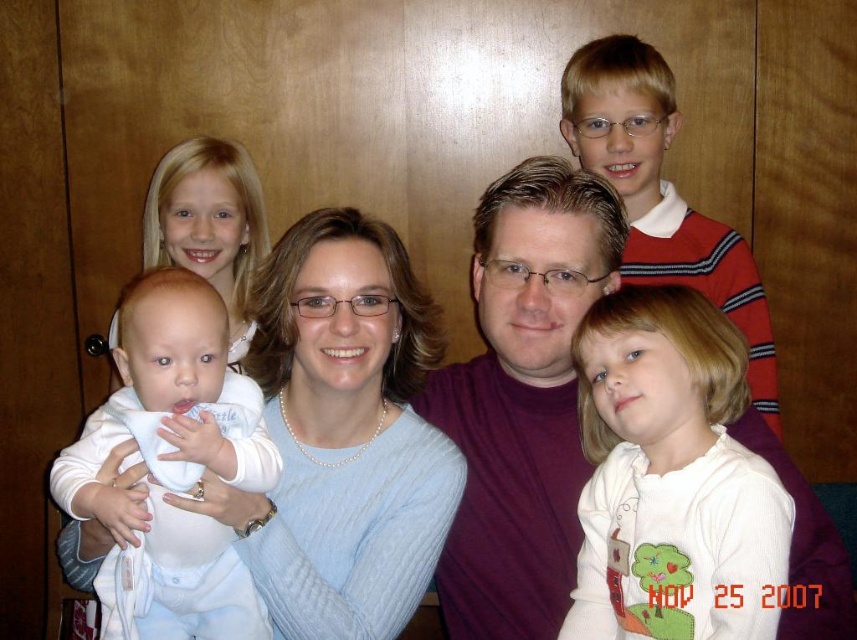
Between maroon t-shirt at center and white soft fabric baby at center, which one is positioned lower?

Positioned lower is white soft fabric baby at center.

Is point (537, 419) positioned behind point (117, 582)?

Yes, point (537, 419) is behind point (117, 582).

The width and height of the screenshot is (857, 640). I want to click on maroon t-shirt at center, so [522, 400].

Locate an element on the screen. Image resolution: width=857 pixels, height=640 pixels. maroon t-shirt at center is located at coordinates (522, 400).

Between white soft shirt at lower right and white soft fabric baby at center, which one is positioned higher?

white soft shirt at lower right is higher up.

The width and height of the screenshot is (857, 640). What do you see at coordinates (670, 477) in the screenshot?
I see `white soft shirt at lower right` at bounding box center [670, 477].

Does point (570, 608) lie in front of point (231, 372)?

No, it is behind (231, 372).

Locate an element on the screen. white soft shirt at lower right is located at coordinates pyautogui.click(x=670, y=477).

Who is more forward, (448, 385) or (650, 212)?

Point (448, 385)

You are a GUI agent. You are given a task and a screenshot of the screen. Output one action in this format:
    pyautogui.click(x=<x>, y=<y>)
    Task: Click on the maroon shirt at center
    This screenshot has height=640, width=857.
    Given the screenshot: What is the action you would take?
    pyautogui.click(x=522, y=400)